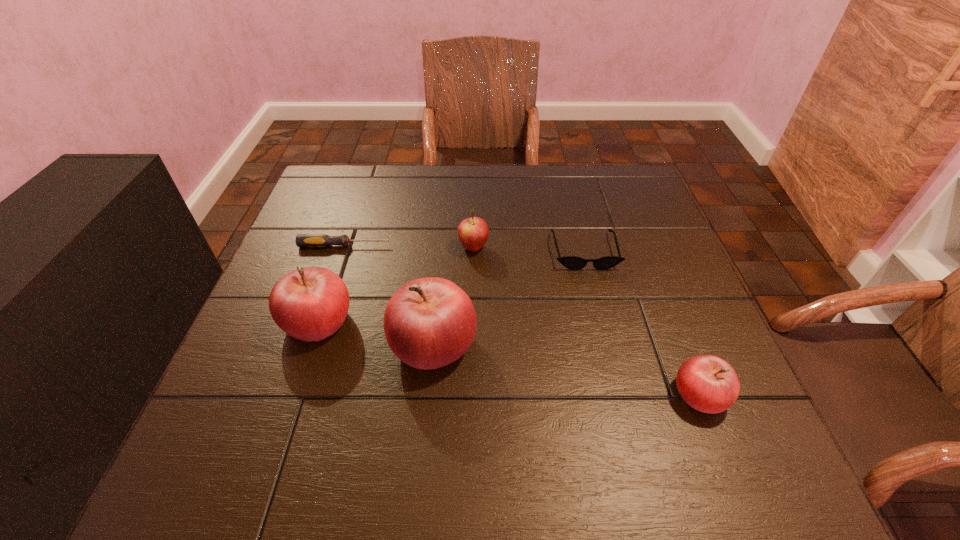
Where is `the third shortest apple`? the third shortest apple is located at coordinates (309, 304).

This screenshot has width=960, height=540. What are the coordinates of `the leftmost apple` in the screenshot? It's located at click(309, 304).

What are the coordinates of `the fourth tallest object` in the screenshot? It's located at (707, 383).

At what (x,y) coordinates should I click in order to perform the action: click on the shortest apple. Please return your answer as a coordinate pair (x, y). Looking at the image, I should click on (707, 383).

The width and height of the screenshot is (960, 540). In order to click on the second shortest object in this screenshot , I will do `click(571, 262)`.

Identify the location of sunglasses. (571, 262).

This screenshot has width=960, height=540. I want to click on the second shortest apple, so click(473, 232).

Locate an element on the screen. This screenshot has width=960, height=540. the fourth shortest object is located at coordinates (473, 232).

You are a GUI agent. You are given a task and a screenshot of the screen. Output one action in this format:
    pyautogui.click(x=<x>, y=<y>)
    Task: Click on the shortest object
    This screenshot has width=960, height=540.
    Given the screenshot: What is the action you would take?
    pyautogui.click(x=302, y=240)

I want to click on vacant space located 0.340m on the back of the second tallest apple, so (x=357, y=204).